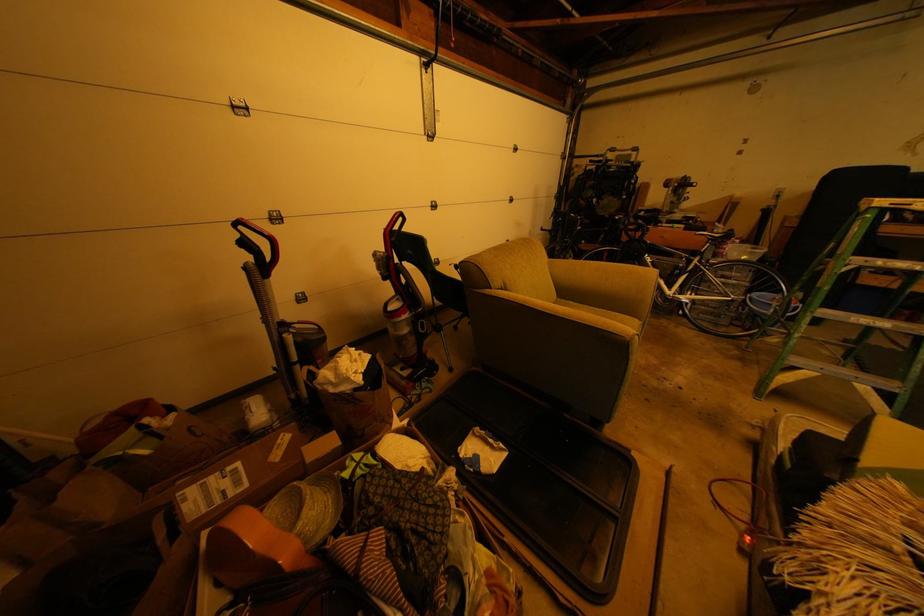
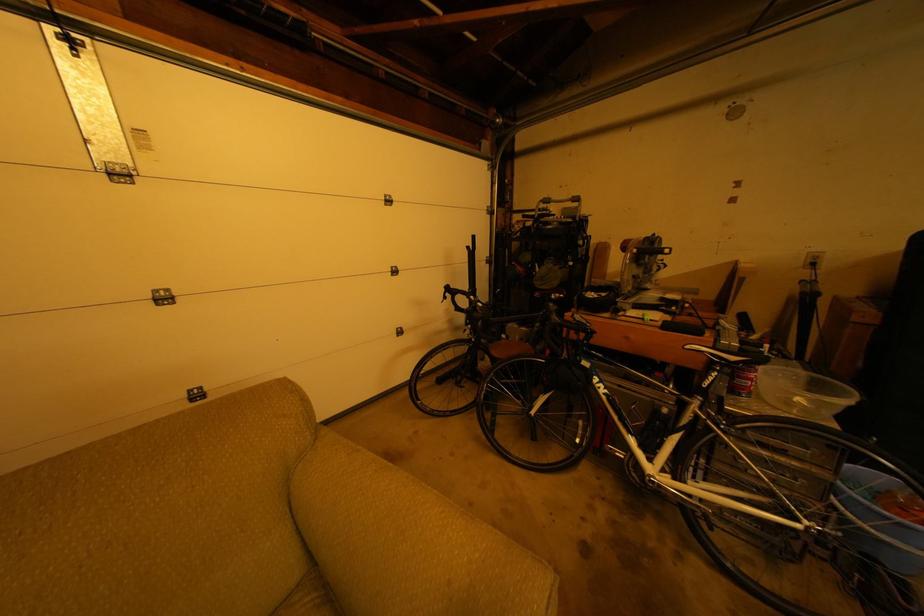
In a continuous first-person perspective shot, in which direction is the camera moving?

The cameraman moved toward right, forward.